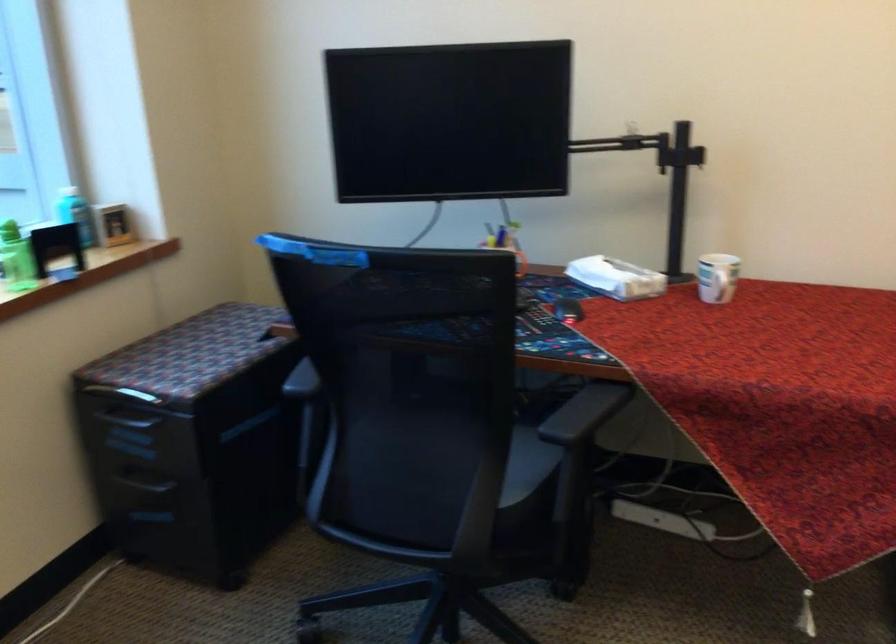
Locate an element on the screen. white mug handle is located at coordinates tap(724, 287).